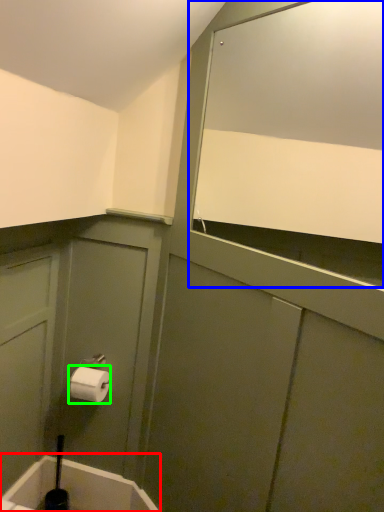
Question: Based on their relative distances, which object is farther from bath (highlighted by a red box)? Choose from mirror (highlighted by a blue box) and toilet paper (highlighted by a green box).

Choices:
 (A) mirror
 (B) toilet paper

Answer: (A)